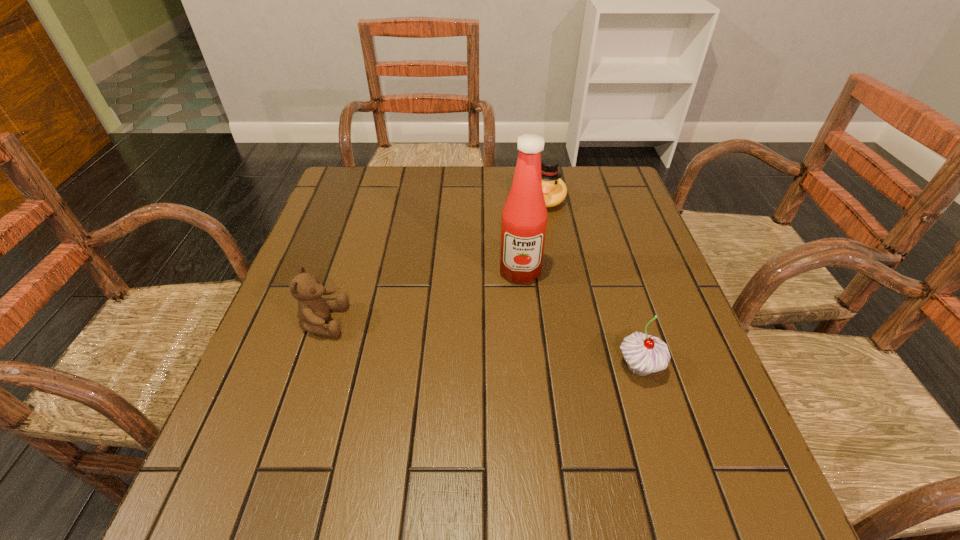
The image size is (960, 540). I want to click on vacant point at the left edge, so click(341, 289).

In the image, there is a desktop. Where is `blank space at the right edge`? The width and height of the screenshot is (960, 540). blank space at the right edge is located at coordinates (643, 380).

You are a GUI agent. You are given a task and a screenshot of the screen. Output one action in this format:
    pyautogui.click(x=<x>, y=<y>)
    Task: Click on the vacant area at the far left corner of the desktop
    This screenshot has width=960, height=540.
    Given the screenshot: What is the action you would take?
    pyautogui.click(x=337, y=184)

Image resolution: width=960 pixels, height=540 pixels. Identify the location of free point at the far right corner. point(620,176).

This screenshot has height=540, width=960. Find the location of `vacant space that's between the teddy bear and the second farthest object`. vacant space that's between the teddy bear and the second farthest object is located at coordinates (421, 296).

This screenshot has width=960, height=540. Identify the location of vacant area that lies between the condiment and the teddy bear. (421, 296).

Identify the location of vacant space in between the farthest object and the leftmost object. (435, 260).

Locate an element on the screen. free space that is in between the third farthest object and the second farthest object is located at coordinates (421, 296).

You are a GUI agent. You are given a task and a screenshot of the screen. Output one action in this format:
    pyautogui.click(x=<x>, y=<y>)
    Task: Click on the vacant space that is in between the second nearest object and the tallest object
    The image size is (960, 540).
    Given the screenshot: What is the action you would take?
    pyautogui.click(x=421, y=296)

This screenshot has height=540, width=960. Identify the location of unoccupied position between the condiment and the teddy bear. (421, 296).